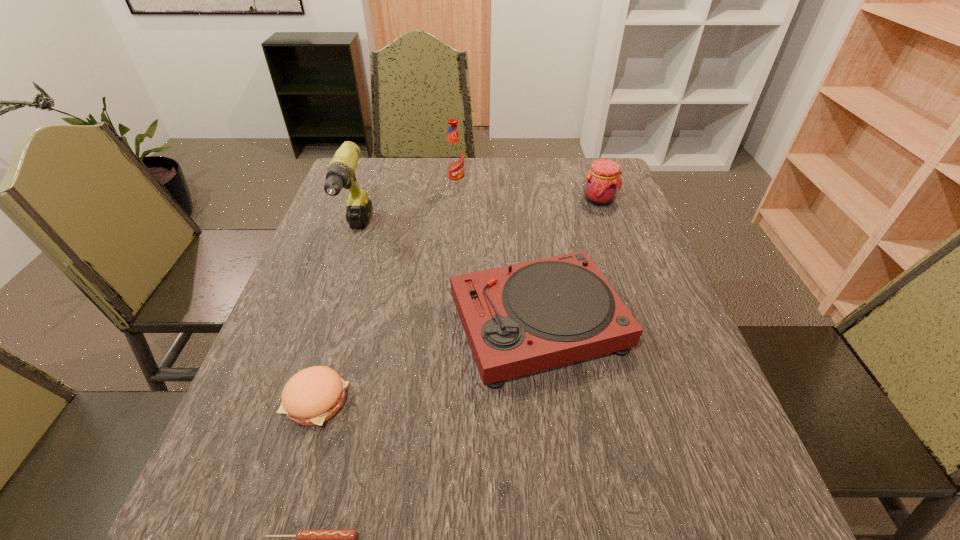
The image size is (960, 540). Identify the location of free location that satisfies the following two spatial constraints: 1. on the handle side of the patty; 2. on the right side of the drill. (300, 401).

You are a GUI agent. You are given a task and a screenshot of the screen. Output one action in this format:
    pyautogui.click(x=<x>, y=<y>)
    Task: Click on the vacant position in the image that satisfies the following two spatial constraints: 1. on the handle side of the second shortest object; 2. on the right side of the drill
    
    Given the screenshot: What is the action you would take?
    pyautogui.click(x=300, y=401)

Where is `free space that satisfies the following two spatial constraints: 1. on the front side of the third tallest object; 2. on the left side of the root beer`? This screenshot has height=540, width=960. free space that satisfies the following two spatial constraints: 1. on the front side of the third tallest object; 2. on the left side of the root beer is located at coordinates (455, 200).

This screenshot has width=960, height=540. I want to click on blank area in the image that satisfies the following two spatial constraints: 1. on the handle side of the fourth tallest object; 2. on the left side of the drill, so click(326, 323).